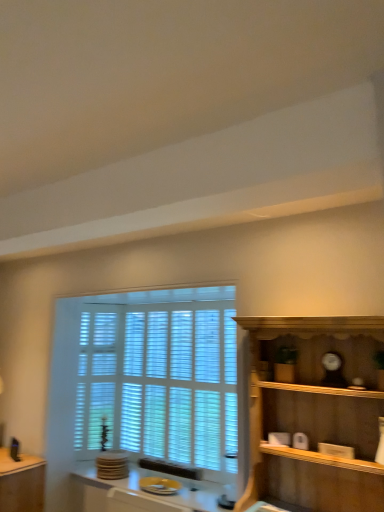
Question: Considering their positions, is wooden shelf at right located in front of or behind yellow glossy plate at lower center?

Choices:
 (A) front
 (B) behind

Answer: (A)

Question: Looking at the image, does wooden shelf at right seem bigger or smaller compared to yellow glossy plate at lower center?

Choices:
 (A) big
 (B) small

Answer: (A)

Question: Which of these objects is positioned closest to the matte brown table at lower left?

Choices:
 (A) wooden shelf at right
 (B) yellow glossy plate at lower center
 (C) white wood window at center

Answer: (B)

Question: Which of these objects is positioned closest to the yellow glossy plate at lower center?

Choices:
 (A) white wood window at center
 (B) wooden shelf at right
 (C) matte brown table at lower left

Answer: (C)